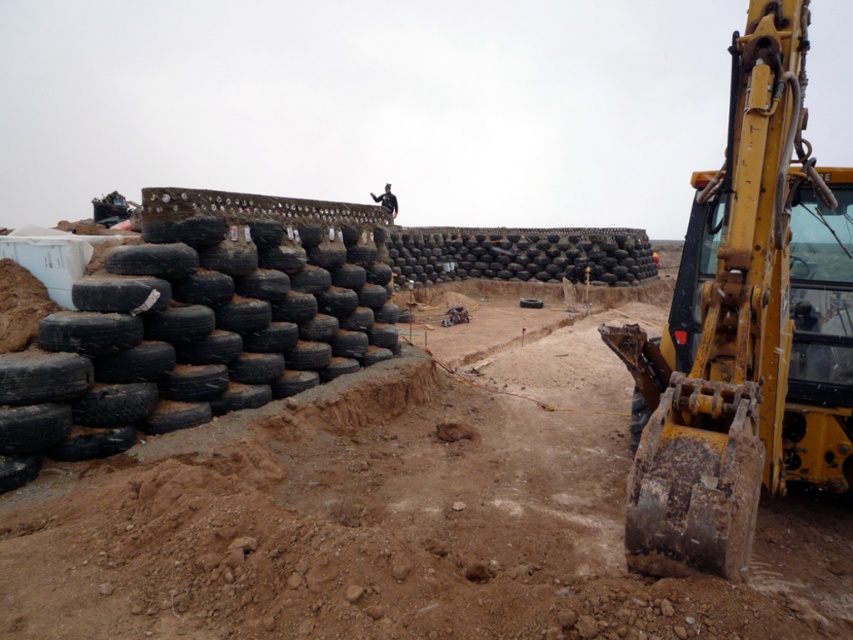
Question: Can you confirm if black rubber tires at left is positioned to the right of black matte construction worker at upper center?

Choices:
 (A) no
 (B) yes

Answer: (A)

Question: From the image, what is the correct spatial relationship of black rubber tires at center in relation to black matte construction worker at upper center?

Choices:
 (A) above
 (B) below

Answer: (B)

Question: Does yellow metallic excavator at right come in front of black rubber tires at center?

Choices:
 (A) no
 (B) yes

Answer: (B)

Question: Which object is positioned farthest from the yellow metallic excavator at right?

Choices:
 (A) black rubber tires at center
 (B) black matte construction worker at upper center

Answer: (A)

Question: Which is farther from the black matte construction worker at upper center?

Choices:
 (A) black rubber tire at center
 (B) black rubber tires at left
 (C) black rubber tires at center

Answer: (A)

Question: Considering the real-world distances, which object is farthest from the yellow metallic excavator at right?

Choices:
 (A) black rubber tire at center
 (B) black rubber tires at center
 (C) black matte construction worker at upper center
 (D) black rubber tires at left

Answer: (B)